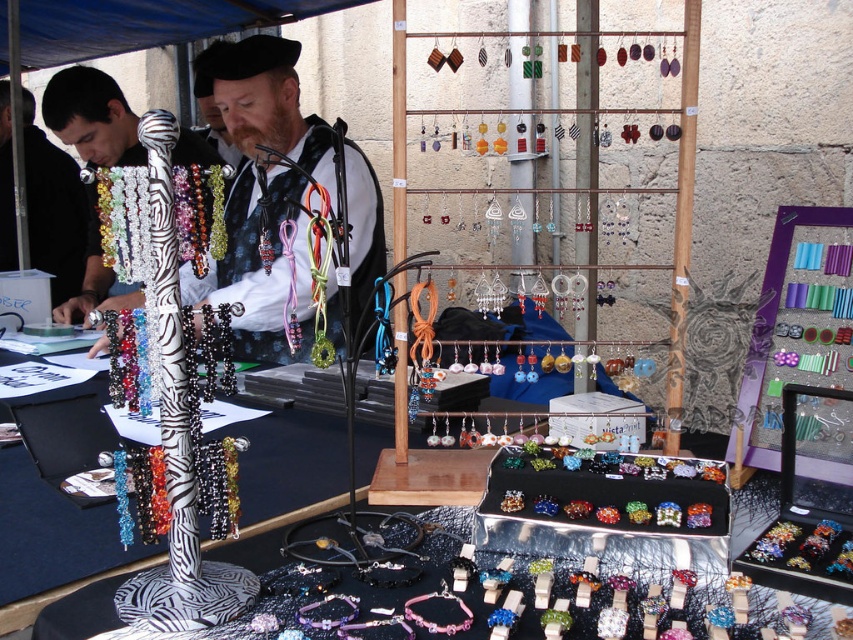
You are a customer at the market stall and want to compare the height of the matte black shirt at left and the multicolored beaded bracelet at center. Which one is taller?

The matte black shirt at left is taller than the multicolored beaded bracelet at center according to the description.